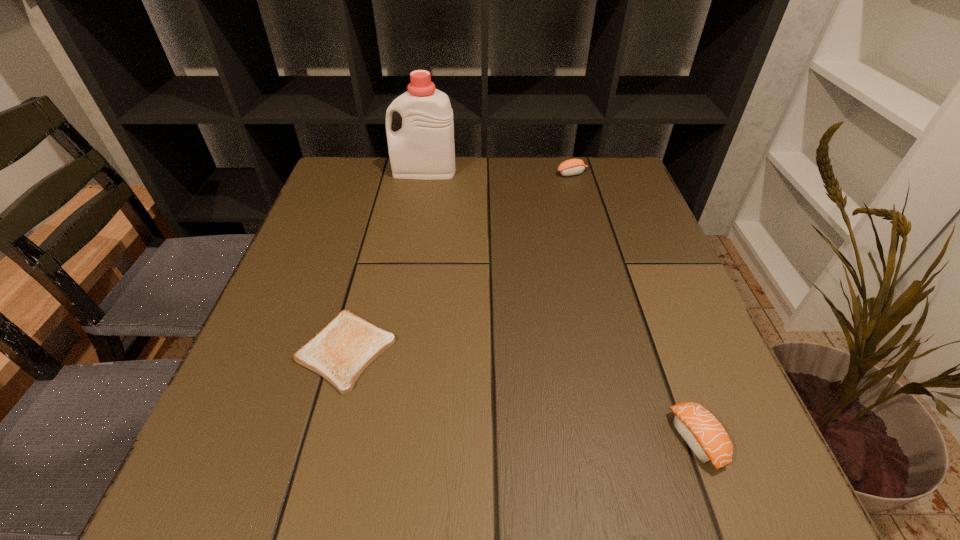
You are a GUI agent. You are given a task and a screenshot of the screen. Output one action in this format:
    pyautogui.click(x=<x>, y=<y>)
    Task: Click on the tallest object
    This screenshot has height=540, width=960.
    Given the screenshot: What is the action you would take?
    pyautogui.click(x=423, y=148)

In order to click on the farther sushi in this screenshot , I will do `click(570, 167)`.

I want to click on the nearest object, so click(703, 433).

I want to click on the second nearest object, so click(342, 349).

The width and height of the screenshot is (960, 540). What are the coordinates of `the shortest object` in the screenshot? It's located at (342, 349).

Find the location of a particular element. free region located 0.120m on the handle side of the detergent is located at coordinates (348, 171).

This screenshot has width=960, height=540. Find the location of `blank space located on the left of the farther sushi`. blank space located on the left of the farther sushi is located at coordinates (506, 173).

Image resolution: width=960 pixels, height=540 pixels. I want to click on free region located on the left of the nearer sushi, so click(609, 440).

The image size is (960, 540). Find the location of `free location located on the back of the shortest object`. free location located on the back of the shortest object is located at coordinates (367, 270).

Image resolution: width=960 pixels, height=540 pixels. In order to click on detergent at the far edge in this screenshot , I will do `click(423, 148)`.